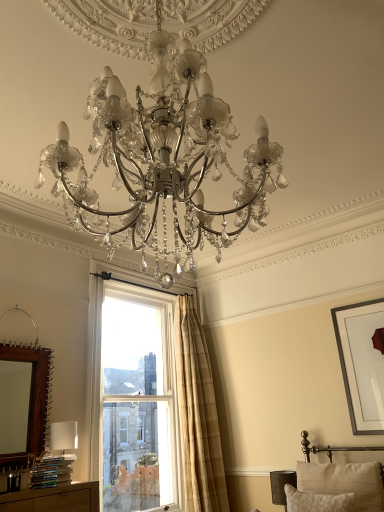
Locate an element on the screen. This screenshot has width=384, height=512. beige textured pillow at lower right, positioned as the second pillow in back-to-front order is located at coordinates (317, 501).

This screenshot has height=512, width=384. Describe the element at coordinates (161, 132) in the screenshot. I see `matte silver chandelier at center` at that location.

Measure the distance between point (192,489) and camera.

The distance of point (192,489) from camera is 3.70 meters.

Find the location of a particular element. beige textured pillow at lower right, which appears as the 1th pillow when viewed from the front is located at coordinates (317, 501).

Considering the relative sizes of beige textured pillow at lower right, which appears as the 1th pillow when viewed from the front, and dark gray fabric lampshade at lower right in the image provided, is beige textured pillow at lower right, which appears as the 1th pillow when viewed from the front, shorter than dark gray fabric lampshade at lower right?

Correct, beige textured pillow at lower right, which appears as the 1th pillow when viewed from the front, is not as tall as dark gray fabric lampshade at lower right.

Is beige textured pillow at lower right, positioned as the second pillow in back-to-front order, aimed at dark gray fabric lampshade at lower right?

No.

Can you confirm if beige textured pillow at lower right, which appears as the 1th pillow when viewed from the front, is smaller than dark gray fabric lampshade at lower right?

Incorrect, beige textured pillow at lower right, which appears as the 1th pillow when viewed from the front, is not smaller in size than dark gray fabric lampshade at lower right.

Measure the distance between beige textured pillow at lower right, positioned as the second pillow in back-to-front order, and dark gray fabric lampshade at lower right.

A distance of 13.45 inches exists between beige textured pillow at lower right, positioned as the second pillow in back-to-front order, and dark gray fabric lampshade at lower right.

From the image's perspective, is dark gray fabric lampshade at lower right above or below beige textured pillow at lower right, which appears as the 1th pillow when viewed from the front?

dark gray fabric lampshade at lower right is situated lower than beige textured pillow at lower right, which appears as the 1th pillow when viewed from the front, in the image.

Could you tell me if dark gray fabric lampshade at lower right is facing beige textured pillow at lower right, which appears as the 1th pillow when viewed from the front?

No, dark gray fabric lampshade at lower right is not aimed at beige textured pillow at lower right, which appears as the 1th pillow when viewed from the front.

Considering the positions of objects dark gray fabric lampshade at lower right and beige textured pillow at lower right, positioned as the second pillow in back-to-front order, in the image provided, who is more to the right, dark gray fabric lampshade at lower right or beige textured pillow at lower right, positioned as the second pillow in back-to-front order,?

beige textured pillow at lower right, positioned as the second pillow in back-to-front order.

Which is correct: dark gray fabric lampshade at lower right is inside beige textured pillow at lower right, which appears as the 1th pillow when viewed from the front, or outside of it?

The correct answer is: outside.

Does matte black picture frame at upper right turn towards beige plaid curtain at upper right?

No, matte black picture frame at upper right is not turned towards beige plaid curtain at upper right.

From the image's perspective, would you say matte black picture frame at upper right is positioned over beige plaid curtain at upper right?

Correct, matte black picture frame at upper right appears higher than beige plaid curtain at upper right in the image.

Between matte black picture frame at upper right and beige plaid curtain at upper right, which one has smaller width?

matte black picture frame at upper right.

From the image's perspective, starting from the dark gray fabric lampshade at lower right, which pillow is the 1st one above? Please provide its 2D coordinates.

[(344, 481)]

Can you confirm if beige textured pillow at lower right, which ranks as the 1th pillow in back-to-front order, is positioned to the left of dark gray fabric lampshade at lower right?

No.

Is dark gray fabric lampshade at lower right at the back of beige textured pillow at lower right, which ranks as the 1th pillow in back-to-front order?

No.

From the image's perspective, would you say beige textured pillow at lower right, the second pillow when ordered from front to back, is shown under dark gray fabric lampshade at lower right?

Incorrect, from the image's perspective, beige textured pillow at lower right, the second pillow when ordered from front to back, is higher than dark gray fabric lampshade at lower right.

Is clear glass window at center to the right of matte silver chandelier at center from the viewer's perspective?

Incorrect, clear glass window at center is not on the right side of matte silver chandelier at center.

How far apart are clear glass window at center and matte silver chandelier at center?

clear glass window at center is 2.62 meters from matte silver chandelier at center.

Is clear glass window at center placed right next to matte silver chandelier at center?

They are not placed beside each other.

Which object is thinner, clear glass window at center or matte silver chandelier at center?

Thinner between the two is clear glass window at center.

Considering the relative sizes of matte black picture frame at upper right and dark gray fabric lampshade at lower right in the image provided, is matte black picture frame at upper right taller than dark gray fabric lampshade at lower right?

Indeed, matte black picture frame at upper right has a greater height compared to dark gray fabric lampshade at lower right.

From the image's perspective, is matte black picture frame at upper right located above or below dark gray fabric lampshade at lower right?

matte black picture frame at upper right is situated higher than dark gray fabric lampshade at lower right in the image.

Is matte black picture frame at upper right to the left or to the right of dark gray fabric lampshade at lower right in the image?

Clearly, matte black picture frame at upper right is on the right of dark gray fabric lampshade at lower right in the image.

The image size is (384, 512). Find the location of `picture frame above the dark gray fabric lampshade at lower right (from the image's perspective)`. picture frame above the dark gray fabric lampshade at lower right (from the image's perspective) is located at coordinates (362, 362).

Does beige textured pillow at lower right, which appears as the 1th pillow when viewed from the front, have a smaller size compared to matte black picture frame at upper right?

Yes.

Is beige textured pillow at lower right, which appears as the 1th pillow when viewed from the front, to the left of matte black picture frame at upper right from the viewer's perspective?

Yes, beige textured pillow at lower right, which appears as the 1th pillow when viewed from the front, is to the left of matte black picture frame at upper right.

How many degrees apart are the facing directions of beige textured pillow at lower right, which appears as the 1th pillow when viewed from the front, and matte black picture frame at upper right?

2.92 degrees.

How distant is beige textured pillow at lower right, which appears as the 1th pillow when viewed from the front, from matte black picture frame at upper right?

beige textured pillow at lower right, which appears as the 1th pillow when viewed from the front, and matte black picture frame at upper right are 37.03 inches apart.

Where is `table lamp on the left of the beige textured pillow at lower right, which appears as the 1th pillow when viewed from the front`? The image size is (384, 512). table lamp on the left of the beige textured pillow at lower right, which appears as the 1th pillow when viewed from the front is located at coordinates (281, 485).

I want to click on the 1st pillow counting from the right of the dark gray fabric lampshade at lower right, so click(x=317, y=501).

Looking at the image, which one is located closer to clear glass window at center, matte silver chandelier at center or brown wooden mirror at left?

brown wooden mirror at left is closer to clear glass window at center.

From the image, which object appears to be nearer to beige plaid curtain at upper right, matte silver chandelier at center or brown wooden mirror at left?

brown wooden mirror at left is positioned closer to the anchor beige plaid curtain at upper right.

Looking at the image, which one is located further to brown wooden mirror at left, matte silver chandelier at center or beige plaid curtain at upper right?

Based on the image, matte silver chandelier at center appears to be further to brown wooden mirror at left.

Estimate the real-world distances between objects in this image. Which object is closer to beige plaid curtain at upper right, beige textured pillow at lower right, which ranks as the 1th pillow in back-to-front order, or matte silver chandelier at center?

beige textured pillow at lower right, which ranks as the 1th pillow in back-to-front order, lies closer to beige plaid curtain at upper right than the other object.

When comparing their distances from beige textured pillow at lower right, which appears as the 1th pillow when viewed from the front, does beige textured pillow at lower right, which ranks as the 1th pillow in back-to-front order, or brown wooden mirror at left seem closer?

beige textured pillow at lower right, which ranks as the 1th pillow in back-to-front order.

When comparing their distances from matte silver chandelier at center, does matte black picture frame at upper right or beige textured pillow at lower right, positioned as the second pillow in back-to-front order, seem further?

matte black picture frame at upper right is positioned further to the anchor matte silver chandelier at center.

Based on their spatial positions, is brown wooden mirror at left or beige textured pillow at lower right, positioned as the second pillow in back-to-front order, closer to clear glass window at center?

The object closer to clear glass window at center is brown wooden mirror at left.

When comparing their distances from beige plaid curtain at upper right, does beige textured pillow at lower right, the second pillow when ordered from front to back, or beige textured pillow at lower right, which appears as the 1th pillow when viewed from the front, seem further?

Among the two, beige textured pillow at lower right, which appears as the 1th pillow when viewed from the front, is located further to beige plaid curtain at upper right.

I want to click on pillow between brown wooden mirror at left and beige textured pillow at lower right, which ranks as the 1th pillow in back-to-front order, so click(317, 501).

Locate an element on the screen. This screenshot has height=512, width=384. window located between brown wooden mirror at left and beige plaid curtain at upper right in the left-right direction is located at coordinates (133, 397).

This screenshot has width=384, height=512. Identify the location of table lamp between brown wooden mirror at left and beige textured pillow at lower right, which appears as the 1th pillow when viewed from the front. (281, 485).

The height and width of the screenshot is (512, 384). Find the location of `table lamp situated between clear glass window at center and matte black picture frame at upper right from left to right`. table lamp situated between clear glass window at center and matte black picture frame at upper right from left to right is located at coordinates (281, 485).